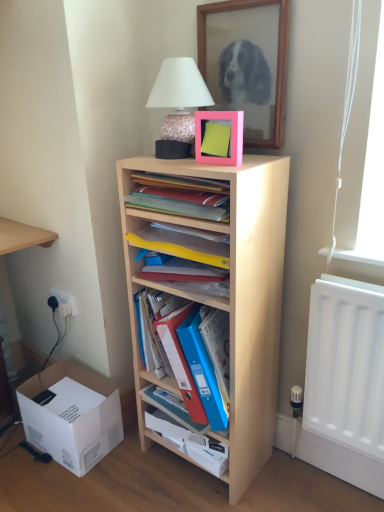
Image resolution: width=384 pixels, height=512 pixels. What are the coordinates of `vacant area that is in front of wooden framed mirror at upper center` in the screenshot? It's located at (247, 156).